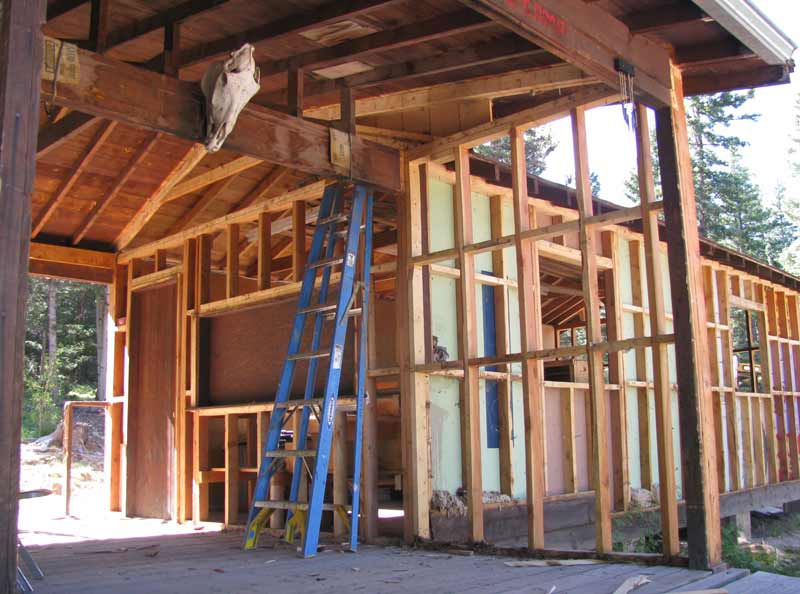
This screenshot has height=594, width=800. I want to click on window, so click(566, 320).